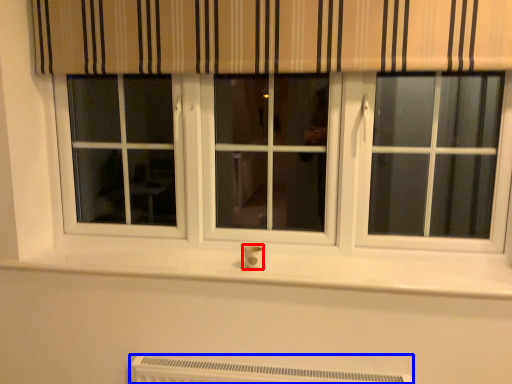
Question: Which of the following is the closest to the observer, electric outlet (highlighted by a red box) or heater (highlighted by a blue box)?

Choices:
 (A) electric outlet
 (B) heater

Answer: (B)